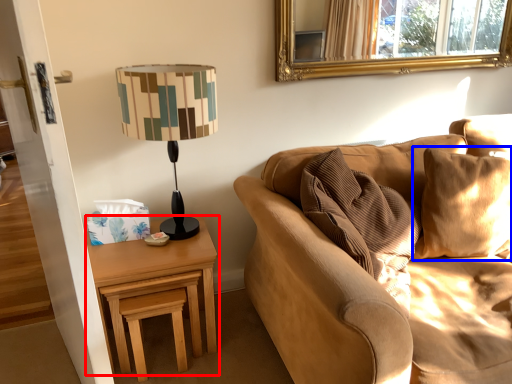
Question: Among these objects, which one is farthest to the camera, nightstand (highlighted by a red box) or pillow (highlighted by a blue box)?

Choices:
 (A) nightstand
 (B) pillow

Answer: (A)